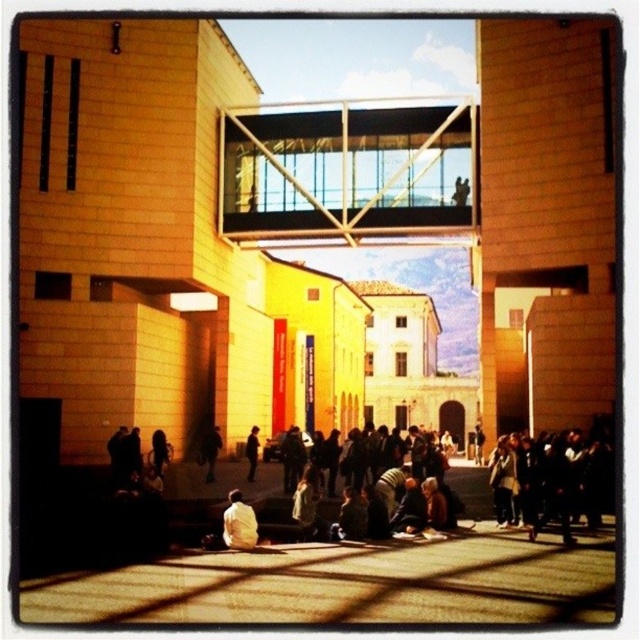
Question: Is dark gray fabric crowd at lower right smaller than dark gray jacket at center?

Choices:
 (A) yes
 (B) no

Answer: (B)

Question: Is light beige fabric at lower center wider than white fabric bag at center?

Choices:
 (A) no
 (B) yes

Answer: (A)

Question: Which of the following is the closest to the observer?

Choices:
 (A) dark gray fabric crowd at lower right
 (B) white fabric bag at center
 (C) light beige fabric at lower center

Answer: (C)

Question: Which point is closer to the camera taking this photo?

Choices:
 (A) (234, 548)
 (B) (577, 474)
 (C) (250, 429)
 (D) (214, 444)

Answer: (A)

Question: Which object is farther from the camera taking this photo?

Choices:
 (A) dark gray fabric crowd at lower right
 (B) dark gray jacket at center

Answer: (B)

Question: Can you confirm if dark gray fabric crowd at lower right is positioned to the left of white fabric bag at center?

Choices:
 (A) yes
 (B) no

Answer: (B)